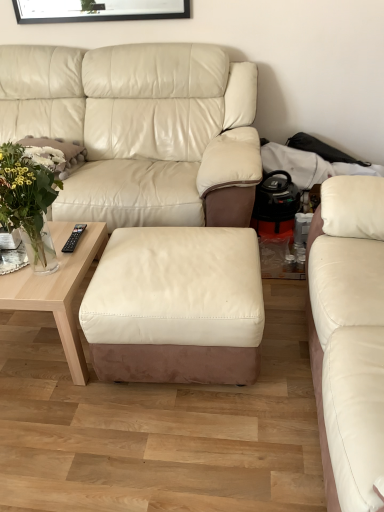
Question: From a real-world perspective, is matte white leather couch at right, marked as the first studio couch in a right-to-left arrangement, positioned over white leather ottoman at center based on gravity?

Choices:
 (A) no
 (B) yes

Answer: (B)

Question: Considering the relative positions of matte white leather couch at right, marked as the first studio couch in a right-to-left arrangement, and white leather ottoman at center in the image provided, is matte white leather couch at right, marked as the first studio couch in a right-to-left arrangement, to the left of white leather ottoman at center from the viewer's perspective?

Choices:
 (A) yes
 (B) no

Answer: (B)

Question: Can you confirm if matte white leather couch at right, the 2th studio couch from the left, is shorter than white leather ottoman at center?

Choices:
 (A) no
 (B) yes

Answer: (A)

Question: Is white leather ottoman at center at the back of matte white leather couch at right, the 2th studio couch from the left?

Choices:
 (A) no
 (B) yes

Answer: (A)

Question: Is matte white leather couch at right, marked as the first studio couch in a right-to-left arrangement, bigger than white leather ottoman at center?

Choices:
 (A) yes
 (B) no

Answer: (A)

Question: From the image's perspective, is matte white leather couch at right, marked as the first studio couch in a right-to-left arrangement, located beneath white leather ottoman at center?

Choices:
 (A) no
 (B) yes

Answer: (A)

Question: Does matte leather couch at center, which ranks as the 1th studio couch in left-to-right order, contain matte white leather couch at right, marked as the first studio couch in a right-to-left arrangement?

Choices:
 (A) no
 (B) yes

Answer: (A)

Question: From the image's perspective, does matte leather couch at center, the second studio couch positioned from the right, appear lower than matte white leather couch at right, the 2th studio couch from the left?

Choices:
 (A) no
 (B) yes

Answer: (A)

Question: Does matte leather couch at center, the second studio couch positioned from the right, have a greater height compared to matte white leather couch at right, the 2th studio couch from the left?

Choices:
 (A) no
 (B) yes

Answer: (B)

Question: Is matte leather couch at center, which ranks as the 1th studio couch in left-to-right order, positioned behind matte white leather couch at right, marked as the first studio couch in a right-to-left arrangement?

Choices:
 (A) no
 (B) yes

Answer: (B)

Question: Is the position of matte leather couch at center, the second studio couch positioned from the right, less distant than that of matte white leather couch at right, marked as the first studio couch in a right-to-left arrangement?

Choices:
 (A) no
 (B) yes

Answer: (A)

Question: Would you say matte leather couch at center, which ranks as the 1th studio couch in left-to-right order, is outside matte white leather couch at right, marked as the first studio couch in a right-to-left arrangement?

Choices:
 (A) no
 (B) yes

Answer: (B)

Question: Is matte white leather couch at right, the 2th studio couch from the left, bigger than white fluffy pillow at left?

Choices:
 (A) yes
 (B) no

Answer: (A)